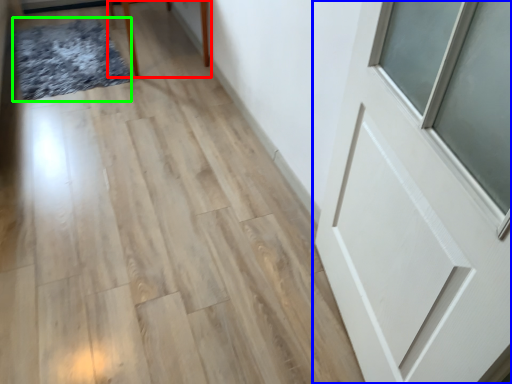
Question: Considering the real-world distances, which object is farthest from furniture (highlighted by a red box)? door (highlighted by a blue box) or mat (highlighted by a green box)?

Choices:
 (A) door
 (B) mat

Answer: (A)